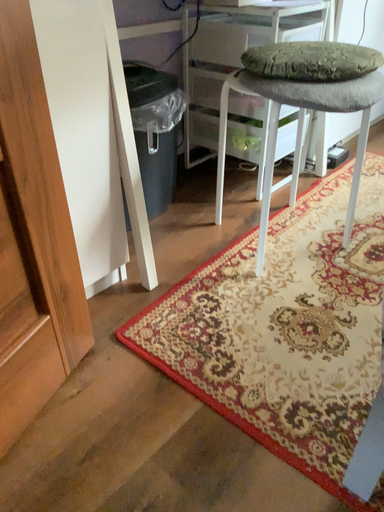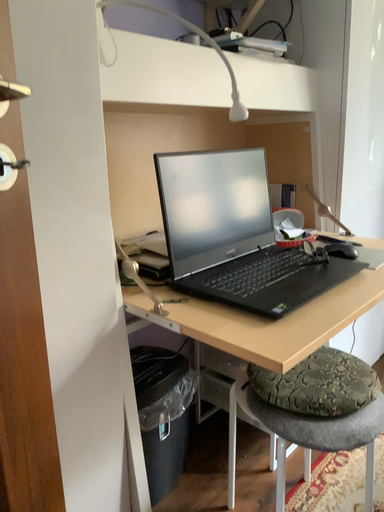
Question: How did the camera likely rotate when shooting the video?

Choices:
 (A) rotated upward
 (B) rotated downward

Answer: (A)